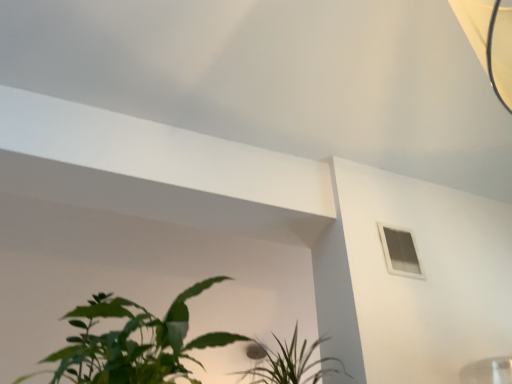
Question: Is white plastic window at upper right wider or thinner than green leafy plant at lower center?

Choices:
 (A) thin
 (B) wide

Answer: (A)

Question: Considering the relative positions of white plastic window at upper right and green leafy plant at lower center in the image provided, is white plastic window at upper right to the left or to the right of green leafy plant at lower center?

Choices:
 (A) left
 (B) right

Answer: (B)

Question: Is white plastic window at upper right taller or shorter than green leafy plant at lower center?

Choices:
 (A) short
 (B) tall

Answer: (B)

Question: Would you say green leafy plant at lower center is inside or outside white plastic window at upper right?

Choices:
 (A) outside
 (B) inside

Answer: (A)

Question: From the image's perspective, relative to white plastic window at upper right, is green leafy plant at lower center above or below?

Choices:
 (A) above
 (B) below

Answer: (B)

Question: In the image, is green leafy plant at lower center positioned in front of or behind white plastic window at upper right?

Choices:
 (A) behind
 (B) front

Answer: (B)

Question: Is green leafy plant at lower center to the left or to the right of white plastic window at upper right in the image?

Choices:
 (A) left
 (B) right

Answer: (A)